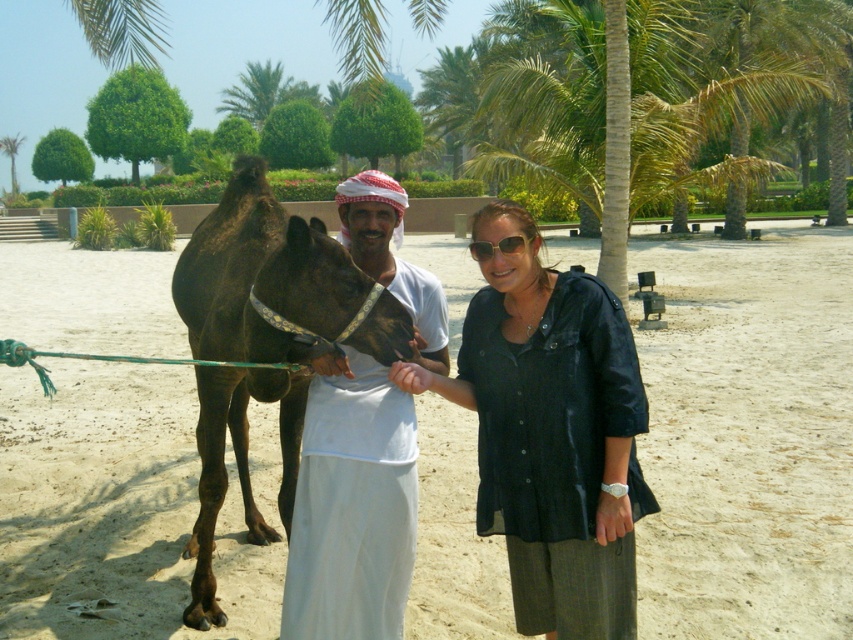
Question: Which object is positioned closest to the green leafy palm tree at upper center?

Choices:
 (A) brown leather camel at center
 (B) green leafy palm tree at upper left
 (C) brown sand at center
 (D) white cotton shirt at center

Answer: (B)

Question: Does brown leather camel at center have a larger size compared to green leafy palm tree at upper left?

Choices:
 (A) no
 (B) yes

Answer: (A)

Question: Estimate the real-world distances between objects in this image. Which object is farther from the green leafy palm tree at upper left?

Choices:
 (A) green leafy palm tree at upper center
 (B) brown leather camel at center
 (C) black matte shirt at center
 (D) brown sand at center

Answer: (C)

Question: Among these points, which one is nearest to the camera?

Choices:
 (A) (598, 132)
 (B) (16, 180)
 (C) (254, 381)
 (D) (577, 355)

Answer: (D)

Question: Where is brown sand at center located in relation to green leafy palm tree at upper left in the image?

Choices:
 (A) above
 (B) below

Answer: (B)

Question: Does green leafy palm tree at center have a lesser width compared to green leafy palm tree at upper center?

Choices:
 (A) no
 (B) yes

Answer: (A)